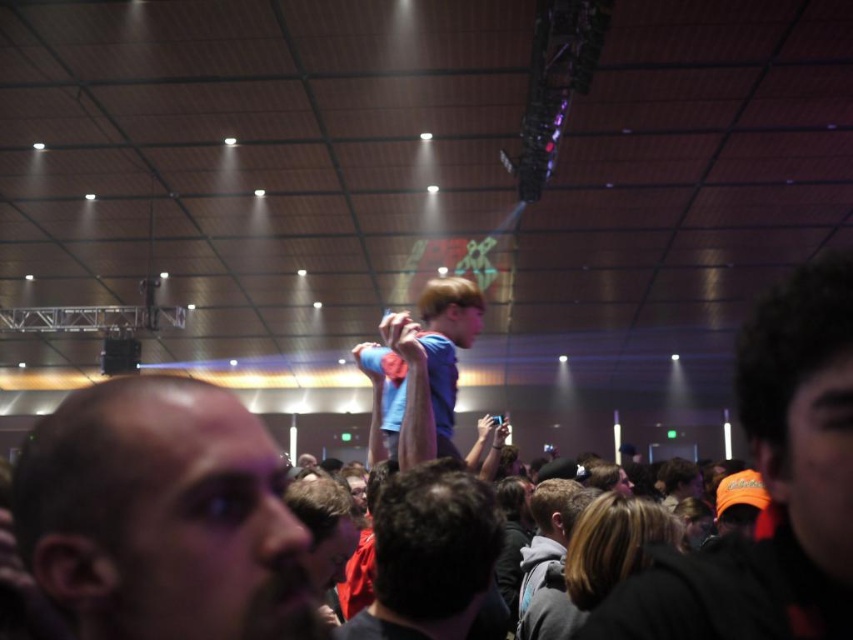
Question: Among these points, which one is farthest from the camera?

Choices:
 (A) (299, 570)
 (B) (844, 428)
 (C) (432, 600)
 (D) (424, 294)

Answer: (D)

Question: Can you confirm if bald head at center is bigger than blue matte shirt at center?

Choices:
 (A) yes
 (B) no

Answer: (B)

Question: Which of the following is the closest to the observer?

Choices:
 (A) dark blue shirt at center
 (B) orange knit cap at center

Answer: (B)

Question: Which point appears farthest from the camera in this image?

Choices:
 (A) (241, 572)
 (B) (845, 509)
 (C) (444, 499)

Answer: (C)

Question: Can you confirm if bald head at center is positioned to the right of orange knit cap at center?

Choices:
 (A) no
 (B) yes

Answer: (A)

Question: Can you confirm if orange knit cap at center is smaller than blue matte shirt at center?

Choices:
 (A) no
 (B) yes

Answer: (B)